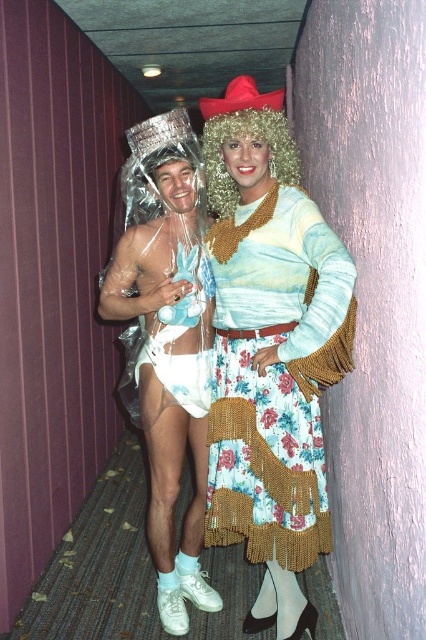
Question: Estimate the real-world distances between objects in this image. Which object is closer to the shiny plastic wrap at left?

Choices:
 (A) floral sequined skirt at center
 (B) fuzzy blonde wig at center

Answer: (A)

Question: Which is nearer to the fuzzy blonde wig at center?

Choices:
 (A) shiny plastic wrap at center
 (B) shiny plastic wrap at left

Answer: (A)

Question: Does floral sequined skirt at center appear on the left side of white sheer fabric at center?

Choices:
 (A) yes
 (B) no

Answer: (B)

Question: Where is shiny plastic wrap at center located in relation to floral sequined skirt at center in the image?

Choices:
 (A) left
 (B) right

Answer: (A)

Question: Which object appears closest to the camera in this image?

Choices:
 (A) shiny plastic wrap at center
 (B) white sheer fabric at center
 (C) floral sequined skirt at center
 (D) fuzzy blonde wig at center

Answer: (C)

Question: Is floral sequined skirt at center to the right of fuzzy blonde wig at center from the viewer's perspective?

Choices:
 (A) no
 (B) yes

Answer: (B)